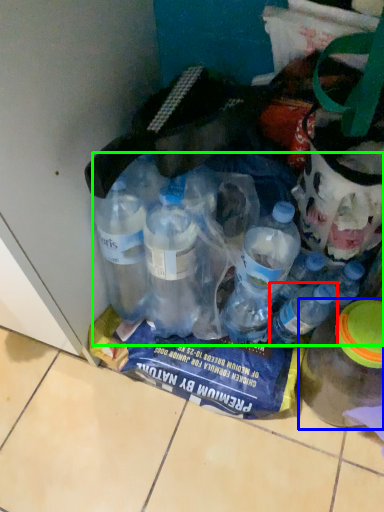
Question: Based on their relative distances, which object is nearer to bottle (highlighted by a red box)? Choose from bottle (highlighted by a blue box) and bottle (highlighted by a green box).

Choices:
 (A) bottle
 (B) bottle

Answer: (A)